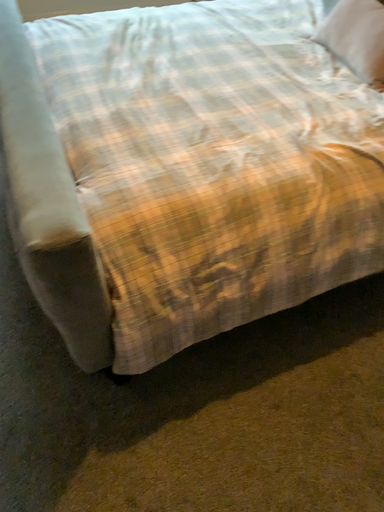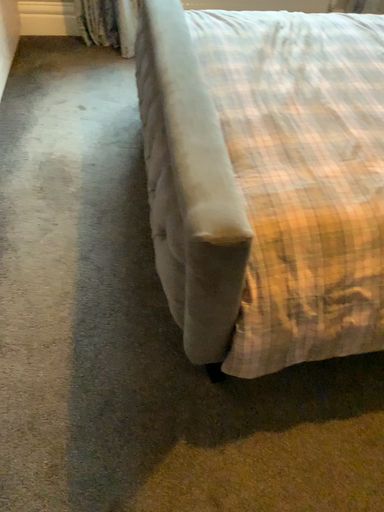
Question: Which way did the camera rotate in the video?

Choices:
 (A) rotated right
 (B) rotated left

Answer: (B)